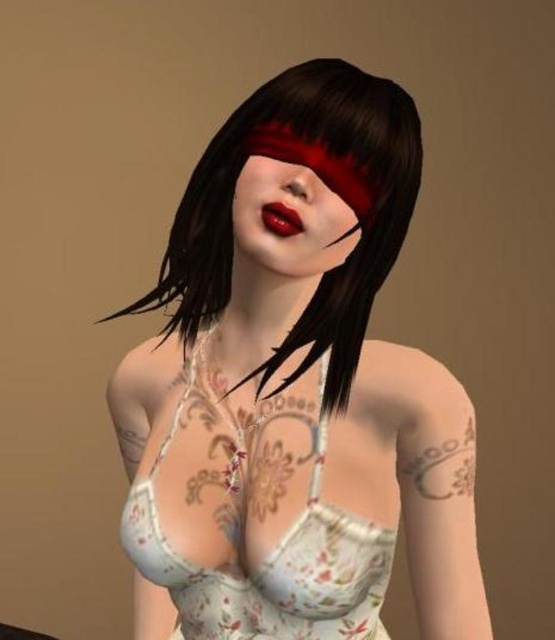
Is point (319, 134) farther from viewer compared to point (310, 497)?

No.

What do you see at coordinates (295, 388) in the screenshot? The image size is (555, 640). I see `matte white lingerie at center` at bounding box center [295, 388].

At what (x,y) coordinates should I click in order to perform the action: click on matte white lingerie at center. Please return your answer as a coordinate pair (x, y). Looking at the image, I should click on (295, 388).

Does floral lace bikini top at center have a greater width compared to matte red lipstick at center?

Yes.

Which of these two, floral lace bikini top at center or matte red lipstick at center, stands shorter?

matte red lipstick at center

Which is behind, point (254, 637) or point (274, 205)?

The point (254, 637) is behind.

At what (x,y) coordinates should I click in order to perform the action: click on floral lace bikini top at center. Please return your answer as a coordinate pair (x, y). Image resolution: width=555 pixels, height=640 pixels. Looking at the image, I should click on (269, 563).

Consider the image. Does matte white lingerie at center come in front of matte red lipstick at center?

Yes, it is.

Who is positioned more to the right, matte white lingerie at center or matte red lipstick at center?

Positioned to the right is matte red lipstick at center.

Image resolution: width=555 pixels, height=640 pixels. What are the coordinates of `matte white lingerie at center` in the screenshot? It's located at (295, 388).